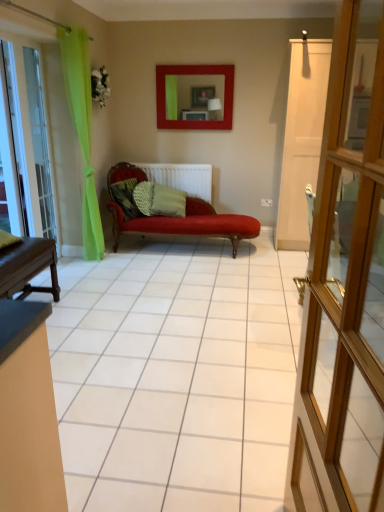
Question: Is camouflage fabric pillow at center, the 2th pillow positioned from the right, positioned with its back to white matte radiator at center?

Choices:
 (A) yes
 (B) no

Answer: (B)

Question: From the image's perspective, is camouflage fabric pillow at center, which is the first pillow in left-to-right order, below white matte radiator at center?

Choices:
 (A) no
 (B) yes

Answer: (B)

Question: Does camouflage fabric pillow at center, the 2th pillow positioned from the right, have a lesser width compared to white matte radiator at center?

Choices:
 (A) no
 (B) yes

Answer: (A)

Question: Is camouflage fabric pillow at center, the 2th pillow positioned from the right, positioned far away from white matte radiator at center?

Choices:
 (A) yes
 (B) no

Answer: (B)

Question: Can you confirm if camouflage fabric pillow at center, which is the first pillow in left-to-right order, is smaller than white matte radiator at center?

Choices:
 (A) no
 (B) yes

Answer: (B)

Question: Is camouflage fabric pillow at center, which is the first pillow in left-to-right order, aimed at white matte radiator at center?

Choices:
 (A) yes
 (B) no

Answer: (B)

Question: Is transparent glass door at left turned away from green textured pillow at center, which is counted as the 1th pillow, starting from the right?

Choices:
 (A) yes
 (B) no

Answer: (B)

Question: Is transparent glass door at left located outside green textured pillow at center, which is counted as the 1th pillow, starting from the right?

Choices:
 (A) yes
 (B) no

Answer: (A)

Question: Is transparent glass door at left positioned in front of green textured pillow at center, the 2th pillow viewed from the left?

Choices:
 (A) no
 (B) yes

Answer: (B)

Question: Is transparent glass door at left touching green textured pillow at center, the 2th pillow viewed from the left?

Choices:
 (A) no
 (B) yes

Answer: (A)

Question: From a real-world perspective, is transparent glass door at left on green textured pillow at center, which is counted as the 1th pillow, starting from the right?

Choices:
 (A) no
 (B) yes

Answer: (B)

Question: From the image's perspective, does transparent glass door at left appear lower than green textured pillow at center, the 2th pillow viewed from the left?

Choices:
 (A) yes
 (B) no

Answer: (B)

Question: Is white matte radiator at center at the left side of matte red picture frame at upper center?

Choices:
 (A) yes
 (B) no

Answer: (A)